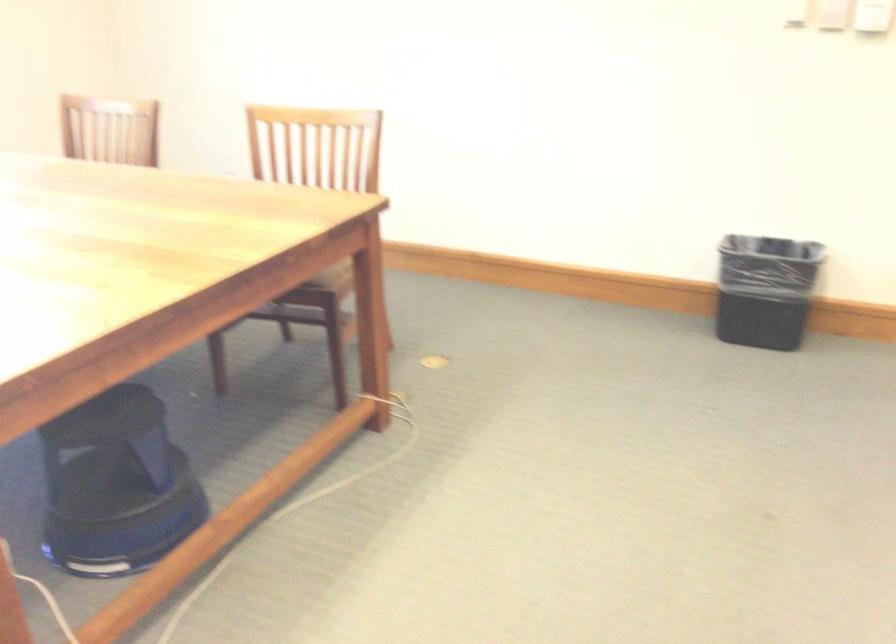
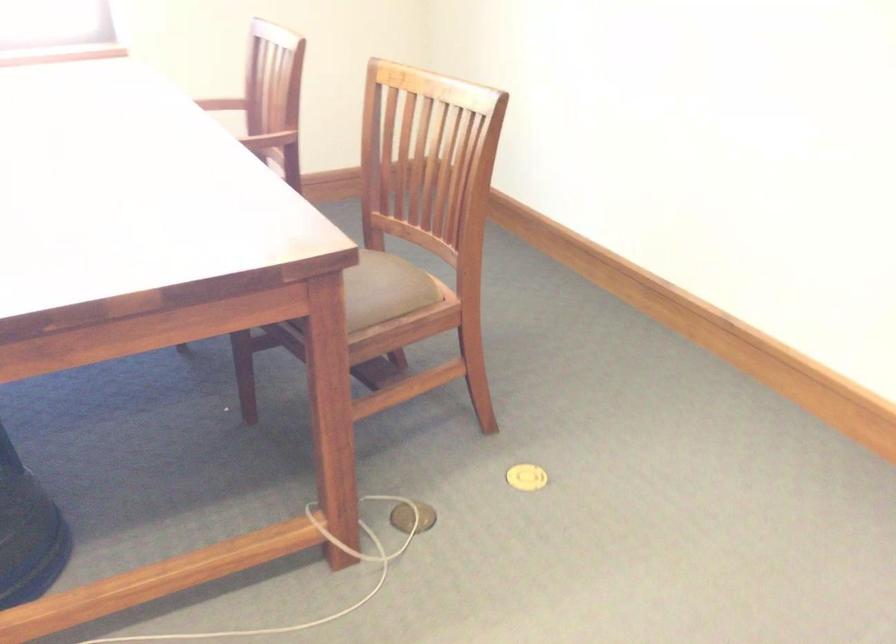
Find the pixel in the second image that matches [434,363] in the first image.

(526, 477)